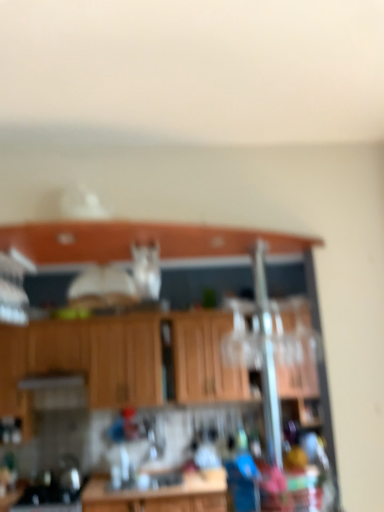
Question: Should I look upward or downward to see wooden cabinets at center?

Choices:
 (A) up
 (B) down

Answer: (B)

Question: From the image's perspective, is wooden cabinet at upper center beneath wooden cabinets at center?

Choices:
 (A) no
 (B) yes

Answer: (A)

Question: Is wooden cabinet at upper center bigger than wooden cabinets at center?

Choices:
 (A) yes
 (B) no

Answer: (B)

Question: From a real-world perspective, is wooden cabinet at upper center located beneath wooden cabinets at center?

Choices:
 (A) yes
 (B) no

Answer: (B)

Question: Does wooden cabinet at upper center come in front of wooden cabinets at center?

Choices:
 (A) yes
 (B) no

Answer: (A)

Question: From a real-world perspective, is wooden cabinet at upper center on wooden cabinets at center?

Choices:
 (A) no
 (B) yes

Answer: (B)

Question: Can you confirm if wooden cabinet at upper center is taller than wooden cabinets at center?

Choices:
 (A) yes
 (B) no

Answer: (B)

Question: Considering the relative positions of wooden cabinets at center and wooden cabinet at upper center in the image provided, is wooden cabinets at center in front of wooden cabinet at upper center?

Choices:
 (A) no
 (B) yes

Answer: (A)

Question: From the image's perspective, is wooden cabinets at center beneath wooden cabinet at upper center?

Choices:
 (A) no
 (B) yes

Answer: (B)

Question: Considering the relative positions of wooden cabinets at center and wooden cabinet at upper center in the image provided, is wooden cabinets at center to the left of wooden cabinet at upper center from the viewer's perspective?

Choices:
 (A) no
 (B) yes

Answer: (B)

Question: Does wooden cabinets at center have a greater height compared to wooden cabinet at upper center?

Choices:
 (A) yes
 (B) no

Answer: (A)

Question: Does wooden cabinets at center have a larger size compared to wooden cabinet at upper center?

Choices:
 (A) no
 (B) yes

Answer: (B)

Question: From a real-world perspective, does wooden cabinets at center sit lower than wooden cabinet at upper center?

Choices:
 (A) yes
 (B) no

Answer: (A)

Question: In the image, is wooden cabinet at upper center positioned in front of or behind wooden cabinets at center?

Choices:
 (A) front
 (B) behind

Answer: (A)